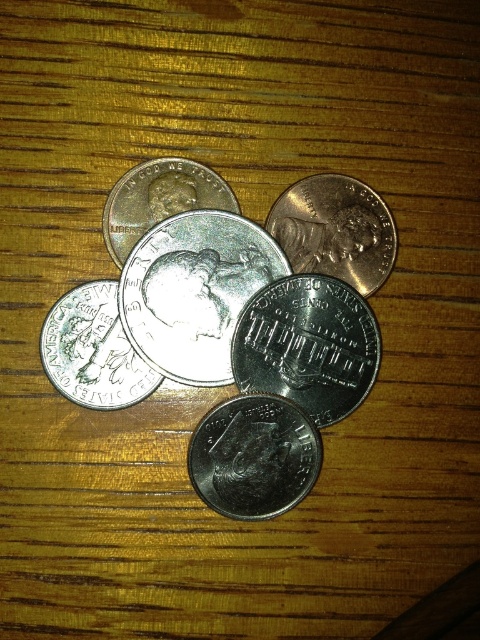
Is point (339, 353) positioned behind point (324, 218)?

No, (339, 353) is in front of (324, 218).

Is silver metallic coin at center wider than shiny copper coin at upper center?

Indeed, silver metallic coin at center has a greater width compared to shiny copper coin at upper center.

Is point (261, 384) positioned in front of point (373, 216)?

That is True.

Identify the location of silver metallic coin at center. (308, 346).

Is silver/metallic coin at center taller than silver/metallic coin at center-left?

Indeed, silver/metallic coin at center has a greater height compared to silver/metallic coin at center-left.

Measure the distance between silver/metallic coin at center and camera.

silver/metallic coin at center and camera are 4.18 feet apart.

This screenshot has height=640, width=480. I want to click on silver/metallic coin at center, so point(194,291).

Is shiny silver coin at center closer to the viewer compared to silver/metallic coin at center-left?

That is True.

I want to click on shiny silver coin at center, so 253,456.